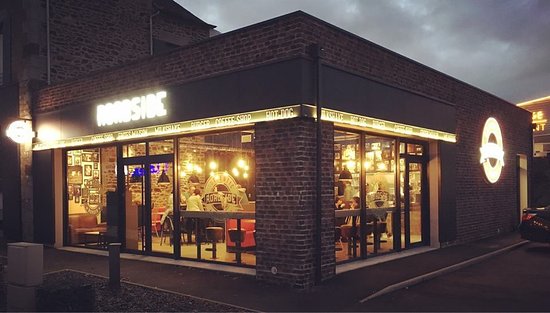
The width and height of the screenshot is (550, 313). Identify the location of electric box. (29, 266).